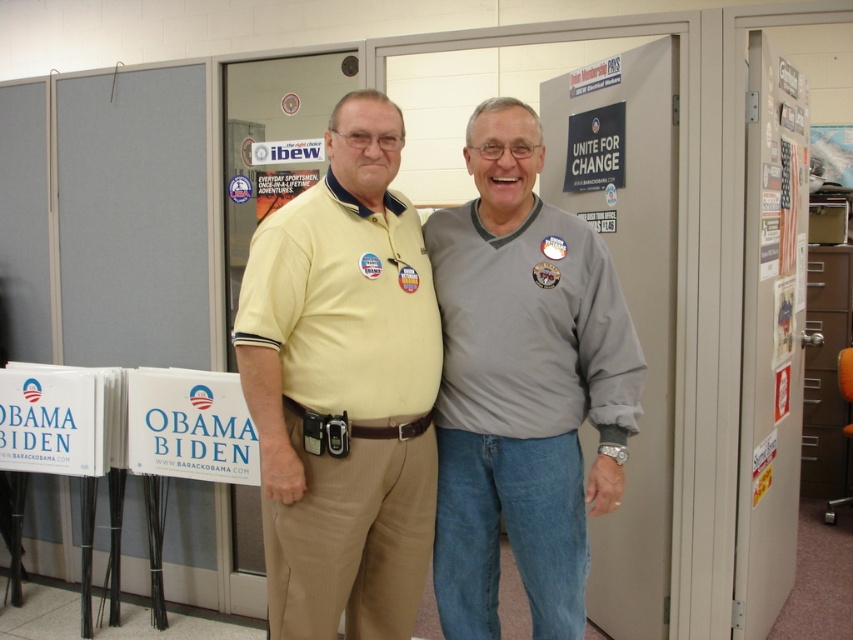
Question: Which point appears farthest from the camera in this image?

Choices:
 (A) (267, 568)
 (B) (776, 394)

Answer: (B)

Question: Is yellow cotton shirt at center behind sticky notes at right?

Choices:
 (A) no
 (B) yes

Answer: (A)

Question: Can you confirm if yellow cotton shirt at center is thinner than sticky notes at right?

Choices:
 (A) yes
 (B) no

Answer: (B)

Question: Which of the following is the farthest from the observer?

Choices:
 (A) (329, 456)
 (B) (784, 492)

Answer: (B)

Question: Is yellow cotton shirt at center wider than sticky notes at right?

Choices:
 (A) yes
 (B) no

Answer: (A)